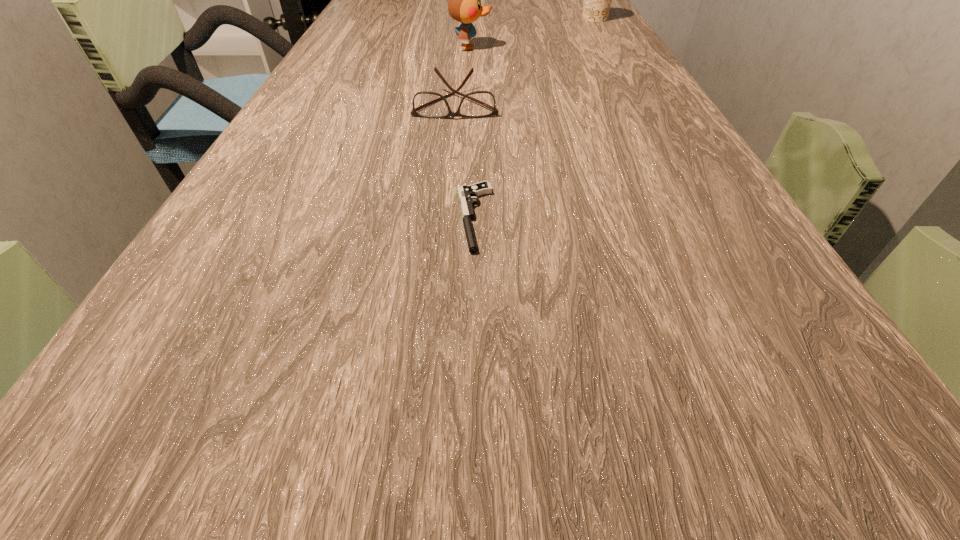
Locate an element on the screen. vacant space located 0.110m on the front-facing side of the third tallest object is located at coordinates (452, 150).

Locate an element on the screen. The height and width of the screenshot is (540, 960). free space located 0.200m on the front-facing side of the nearest object is located at coordinates (316, 218).

At what (x,y) coordinates should I click in order to perform the action: click on blank area located 0.080m on the front-facing side of the nearest object. Please return your answer as a coordinate pair (x, y). The width and height of the screenshot is (960, 540). Looking at the image, I should click on (399, 218).

I want to click on vacant space located 0.210m on the front-facing side of the nearest object, so click(x=309, y=218).

Find the location of a particular element. This screenshot has width=960, height=540. object present at the right edge is located at coordinates (597, 0).

You are a GUI agent. You are given a task and a screenshot of the screen. Output one action in this format:
    pyautogui.click(x=<x>, y=<y>)
    Task: Click on the blank area at the left edge
    
    Given the screenshot: What is the action you would take?
    pyautogui.click(x=287, y=272)

In order to click on free point at the right edge in this screenshot , I will do `click(632, 178)`.

The height and width of the screenshot is (540, 960). Find the location of `vacant area that lies between the second tallest object and the pistol`. vacant area that lies between the second tallest object and the pistol is located at coordinates (535, 118).

You are a GUI agent. You are given a task and a screenshot of the screen. Output one action in this format:
    pyautogui.click(x=<x>, y=<y>)
    Task: Click on the unoccupied position between the spectacles and the shortest object
    This screenshot has height=540, width=960.
    Given the screenshot: What is the action you would take?
    pyautogui.click(x=465, y=160)

At what (x,y) coordinates should I click in order to perform the action: click on vacant space that is in between the rightmost object and the third tallest object. Please return your answer as a coordinate pair (x, y). Image resolution: width=960 pixels, height=540 pixels. Looking at the image, I should click on (525, 61).